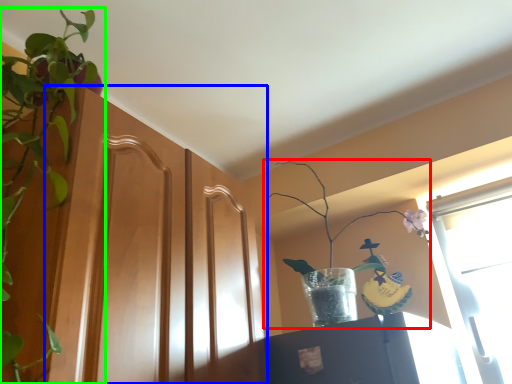
Question: Which is farther away from houseplant (highlighted by a red box)? screen door (highlighted by a blue box) or houseplant (highlighted by a green box)?

Choices:
 (A) screen door
 (B) houseplant

Answer: (B)